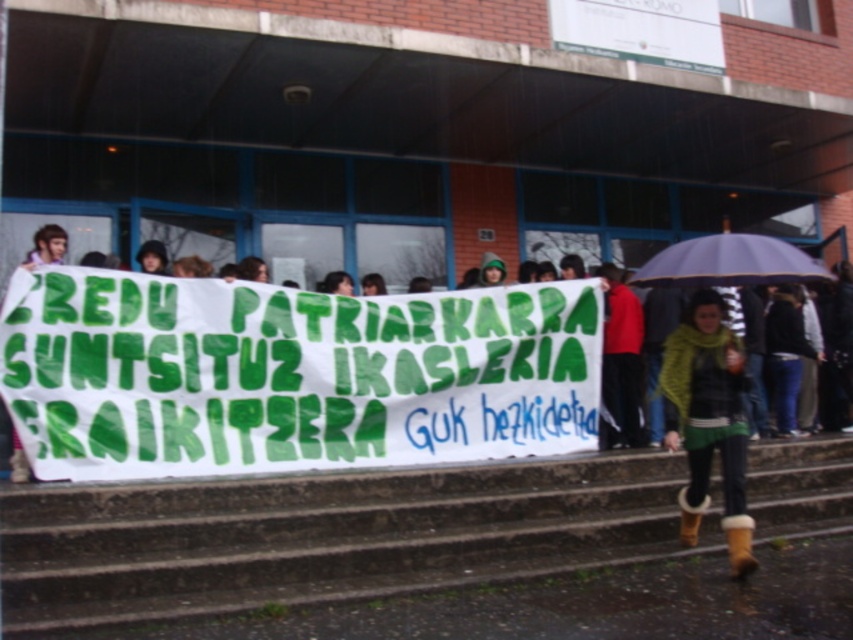
Question: Considering the relative positions of concrete stairs at center and green fuzzy boots at lower right in the image provided, where is concrete stairs at center located with respect to green fuzzy boots at lower right?

Choices:
 (A) above
 (B) below

Answer: (B)

Question: Which object is the farthest from the concrete stairs at center?

Choices:
 (A) green fuzzy boots at lower right
 (B) red matte jacket at center
 (C) light brown hair at upper left

Answer: (C)

Question: Can you confirm if green fuzzy boots at lower right is thinner than light brown hair at upper left?

Choices:
 (A) yes
 (B) no

Answer: (B)

Question: Which of the following is the closest to the observer?

Choices:
 (A) (608, 365)
 (B) (328, 513)

Answer: (B)

Question: Which point is closer to the camera?

Choices:
 (A) (740, 531)
 (B) (780, 244)
 (C) (148, 490)

Answer: (A)

Question: Can you confirm if matte purple umbrella at right is bigger than light brown hair at upper left?

Choices:
 (A) yes
 (B) no

Answer: (A)